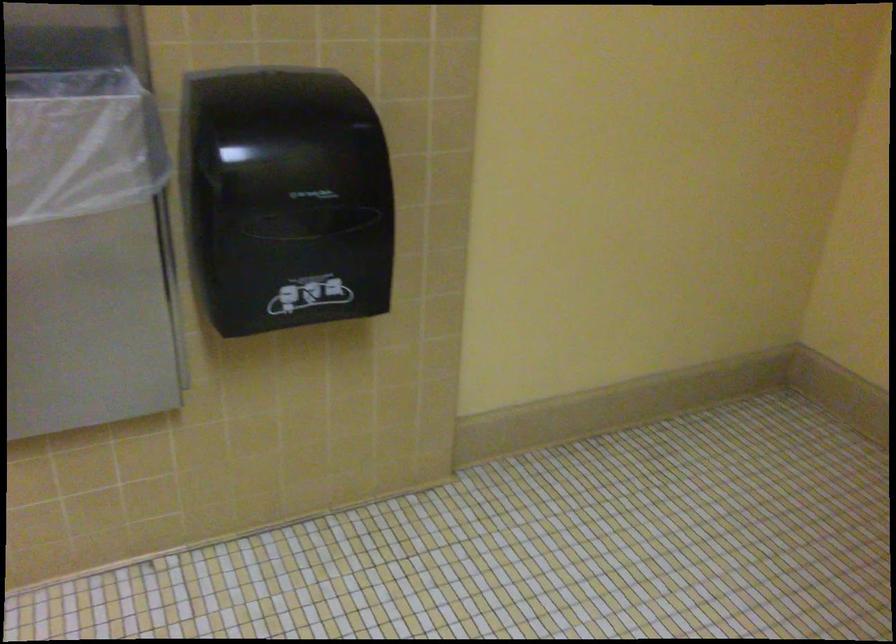
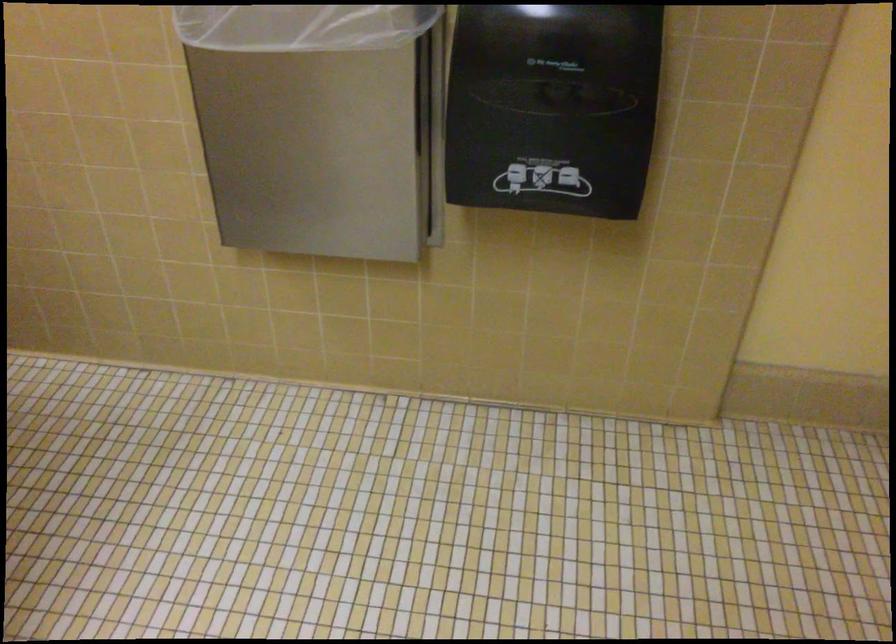
Find the pixel in the second image that matches [281,232] in the first image.

(552, 107)